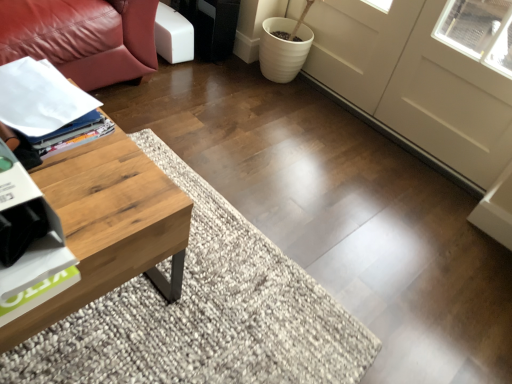
Identify the location of vacant space situated above white glossy magazine at left (from a real-world perspective). The image size is (512, 384). point(38,92).